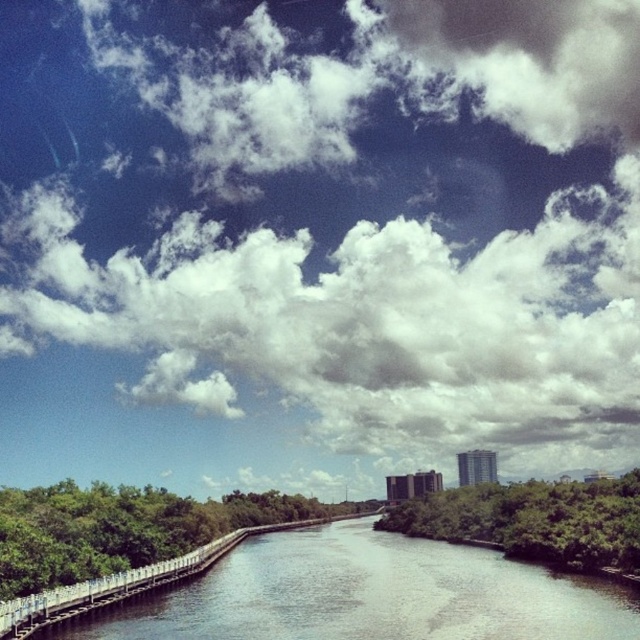
Question: Is white fluffy cloud at upper center positioned in front of white wooden bridge at lower left?

Choices:
 (A) yes
 (B) no

Answer: (B)

Question: Estimate the real-world distances between objects in this image. Which object is closer to the white fluffy cloud at upper center?

Choices:
 (A) white wooden bridge at lower left
 (B) greenish-gray concrete river at center

Answer: (A)

Question: Which object is positioned farthest from the white wooden bridge at lower left?

Choices:
 (A) greenish-gray concrete river at center
 (B) white fluffy cloud at upper center

Answer: (B)

Question: Is greenish-gray concrete river at center to the left of white wooden bridge at lower left from the viewer's perspective?

Choices:
 (A) yes
 (B) no

Answer: (B)

Question: Considering the relative positions of white fluffy cloud at upper center and white wooden bridge at lower left in the image provided, where is white fluffy cloud at upper center located with respect to white wooden bridge at lower left?

Choices:
 (A) above
 (B) below

Answer: (A)

Question: Based on their relative distances, which object is farther from the greenish-gray concrete river at center?

Choices:
 (A) white fluffy cloud at upper center
 (B) white wooden bridge at lower left

Answer: (A)